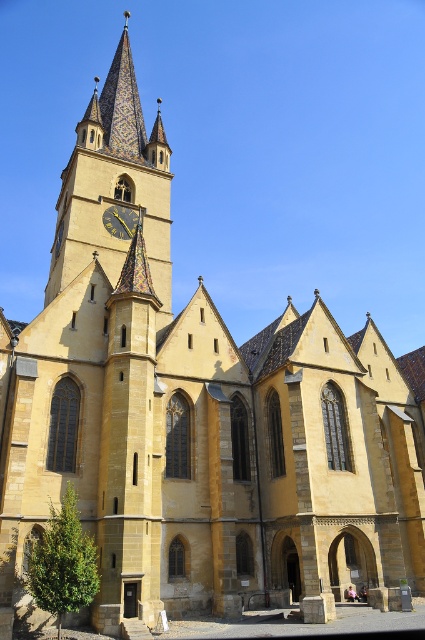
You are a window cleaner standing on a platform that can reach up to 12 meters. You need to clean both the golden mosaic spire at upper center and the gold textured clock at upper center. Can you clean both using the same platform without moving it?

The golden mosaic spire at upper center and gold textured clock at upper center are 11.99 meters apart. Since the platform can reach up to 12 meters, you can clean both using the same platform without moving it as the distance between them is within the platform reach.

You are standing in front of the church and want to locate the golden mosaic spire at upper center. What is the coordinate of it?

The golden mosaic spire at upper center is located at coordinate point (113,188).

You are an architect evaluating the structural integrity of the church. You notice the golden mosaic spire at upper center and the gold textured clock at upper center. Which object is located higher in the image?

The golden mosaic spire at upper center is positioned over the gold textured clock at upper center, so it is higher.